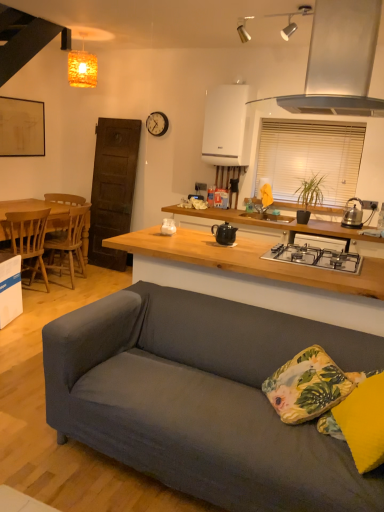
Question: Based on their sizes in the image, would you say black matte gas stove at center is bigger or smaller than white blinds at upper right?

Choices:
 (A) small
 (B) big

Answer: (A)

Question: Considering the positions of black matte gas stove at center and white blinds at upper right in the image, is black matte gas stove at center taller or shorter than white blinds at upper right?

Choices:
 (A) tall
 (B) short

Answer: (B)

Question: Considering the real-world distances, which object is farthest from the white wooden clock at upper center?

Choices:
 (A) satin silver range hood at upper right
 (B) white glossy cabinet at upper center
 (C) white glossy coffee cup at center
 (D) floral fabric pillow at lower right, which is the first pillow from back to front
 (E) black ceramic teapot at center

Answer: (D)

Question: Which object is positioned closest to the matte yellow pillow at lower right, the 2th pillow viewed from the back?

Choices:
 (A) floral fabric pillow at lower right, which is the first pillow from back to front
 (B) white glossy cabinet at upper center
 (C) white blinds at upper right
 (D) black ceramic teapot at center
 (E) black matte gas stove at center

Answer: (A)